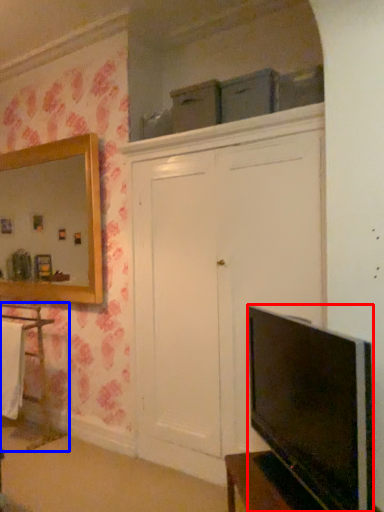
Question: Which object appears closest to the camera in this image, television (highlighted by a red box) or cabinetry (highlighted by a blue box)?

Choices:
 (A) television
 (B) cabinetry

Answer: (A)